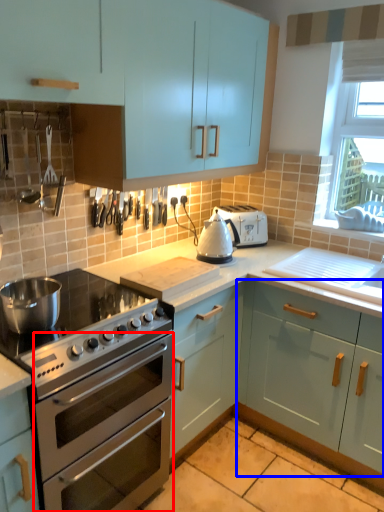
Question: Which object is further to the camera taking this photo, oven (highlighted by a red box) or cabinetry (highlighted by a blue box)?

Choices:
 (A) oven
 (B) cabinetry

Answer: (B)